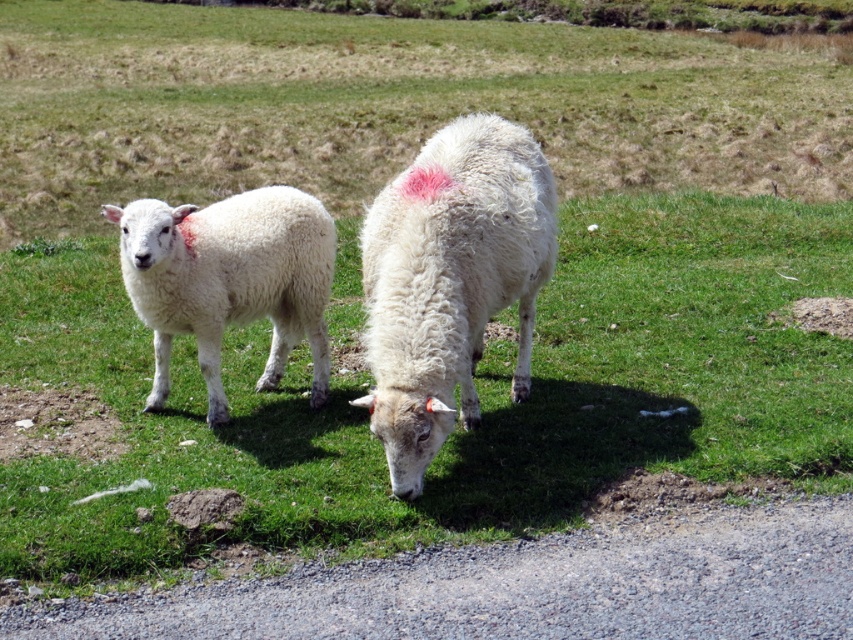
You are a farmer who needs to separate the white woolen sheep at center and the white woolen lamb at left using a fence. The fence you have is 36 inches long. Will the fence be sufficient to place between them to separate them?

The distance between the white woolen sheep at center and the white woolen lamb at left is 35.82 inches. Since the fence is 36 inches long, it will be sufficient to place between them to separate them.

Based on the photo, you are standing on the gravel path and want to approach the white woolen lamb at left and the white woolen sheep at center. Which animal should you approach first to reach the one closer to you?

You should approach the white woolen sheep at center first because it is closer to you than the white woolen lamb at left.